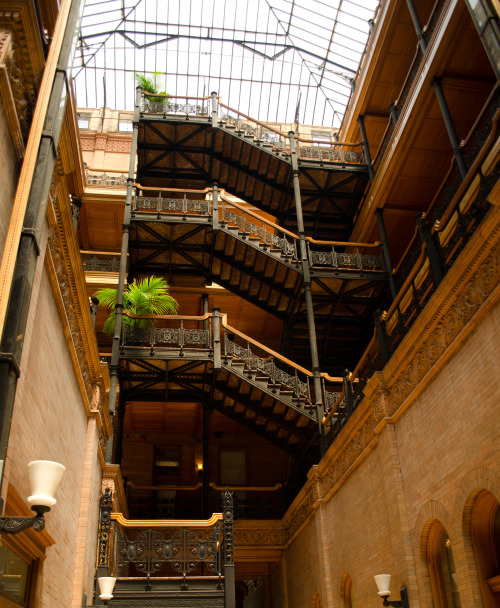
Locate an element on the screen. hand railing is located at coordinates (163, 520), (228, 328), (190, 190), (185, 95).